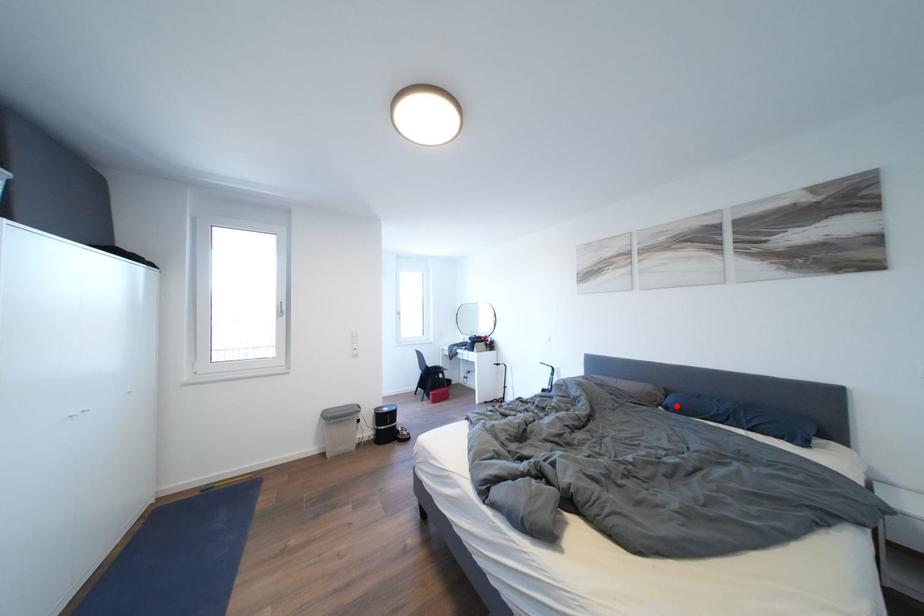
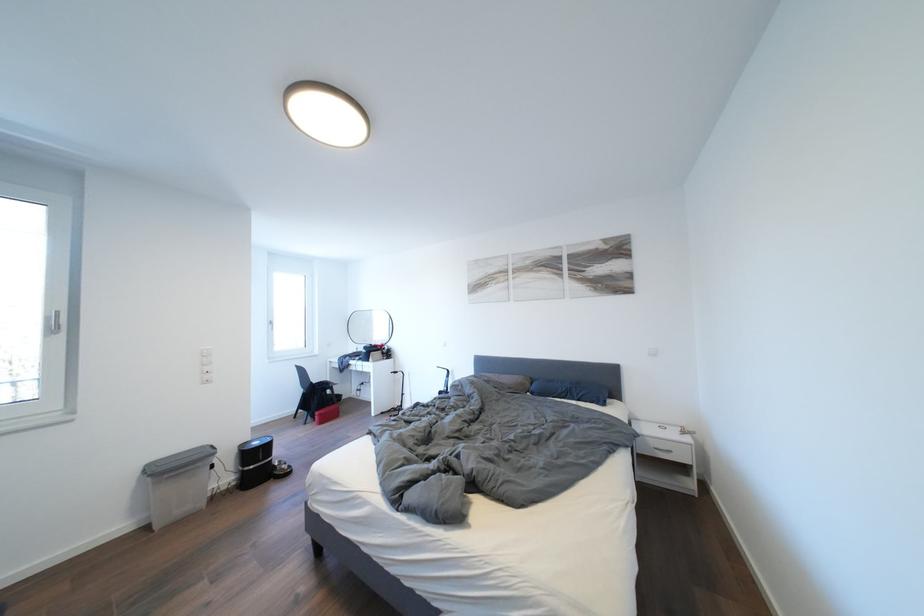
Locate, in the second image, the point that corresponds to the highlighted location in the first image.

(541, 392)